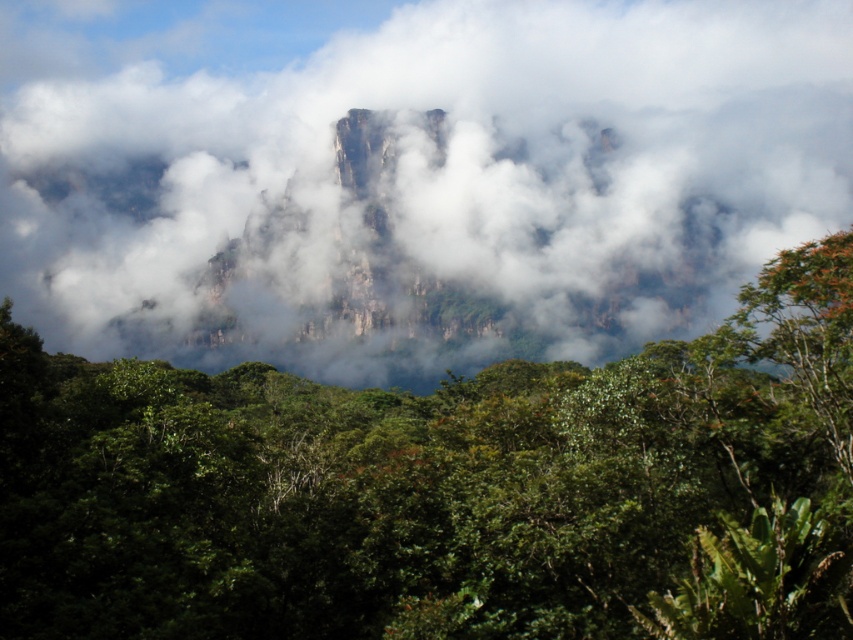
Question: Is white fluffy cloud at center to the left of green leafy tree at upper center from the viewer's perspective?

Choices:
 (A) yes
 (B) no

Answer: (A)

Question: Can you confirm if white fluffy cloud at center is wider than green leafy tree at upper center?

Choices:
 (A) no
 (B) yes

Answer: (B)

Question: Can you confirm if white fluffy cloud at center is wider than green leafy tree at upper center?

Choices:
 (A) no
 (B) yes

Answer: (B)

Question: Which point is farther to the camera?

Choices:
 (A) (538, 515)
 (B) (682, 312)

Answer: (B)

Question: Among these points, which one is nearest to the camera?

Choices:
 (A) (73, 298)
 (B) (747, 602)

Answer: (B)